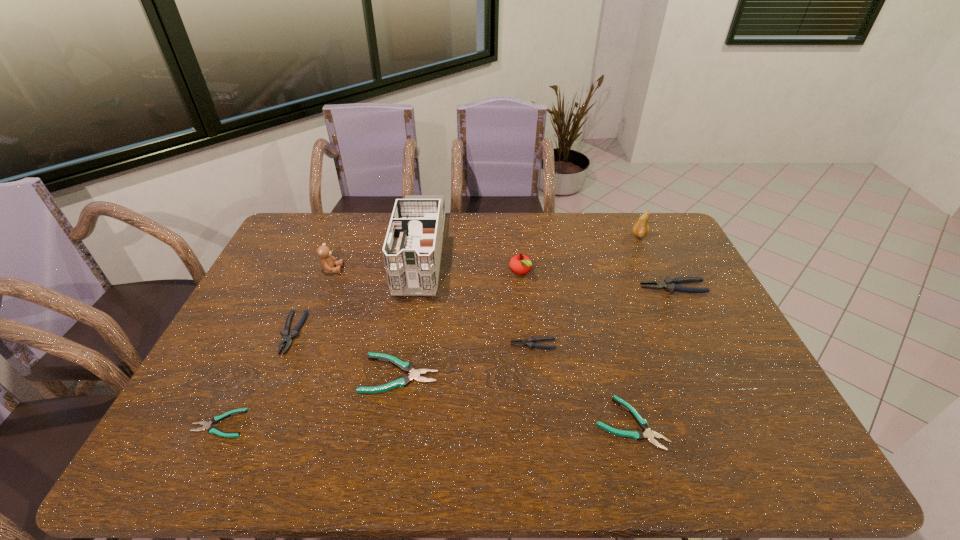
Identify the location of the second gray pliers from right to left. [x=529, y=342].

Find the location of a particular element. The width and height of the screenshot is (960, 540). the third pliers from left to right is located at coordinates (414, 374).

Where is `the biggest teal pliers`? The height and width of the screenshot is (540, 960). the biggest teal pliers is located at coordinates (414, 374).

Where is `the rightmost teal pliers`? The image size is (960, 540). the rightmost teal pliers is located at coordinates (637, 435).

Locate an element on the screen. the fifth pliers from left to right is located at coordinates (637, 435).

At what (x,y) coordinates should I click in order to perform the action: click on the shortest object. Please return your answer as a coordinate pair (x, y). The width and height of the screenshot is (960, 540). Looking at the image, I should click on (206, 425).

Find the location of a particular element. the smallest teal pliers is located at coordinates (206, 425).

Where is `free space located 0.330m at the entrance of the dollhouse`? The height and width of the screenshot is (540, 960). free space located 0.330m at the entrance of the dollhouse is located at coordinates (397, 387).

Where is `free space located 0.120m on the front of the pear`? free space located 0.120m on the front of the pear is located at coordinates (651, 261).

Locate an element on the screen. vacant space situated 0.370m on the face of the teddy bear is located at coordinates (452, 269).